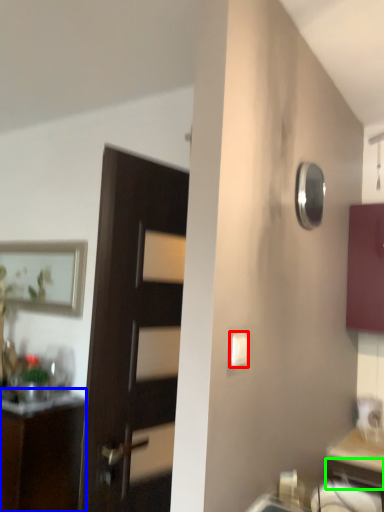
Question: Considering the real-world distances, which object is farthest from light switch (highlighted by a red box)? cabinetry (highlighted by a blue box) or drawer (highlighted by a green box)?

Choices:
 (A) cabinetry
 (B) drawer

Answer: (A)